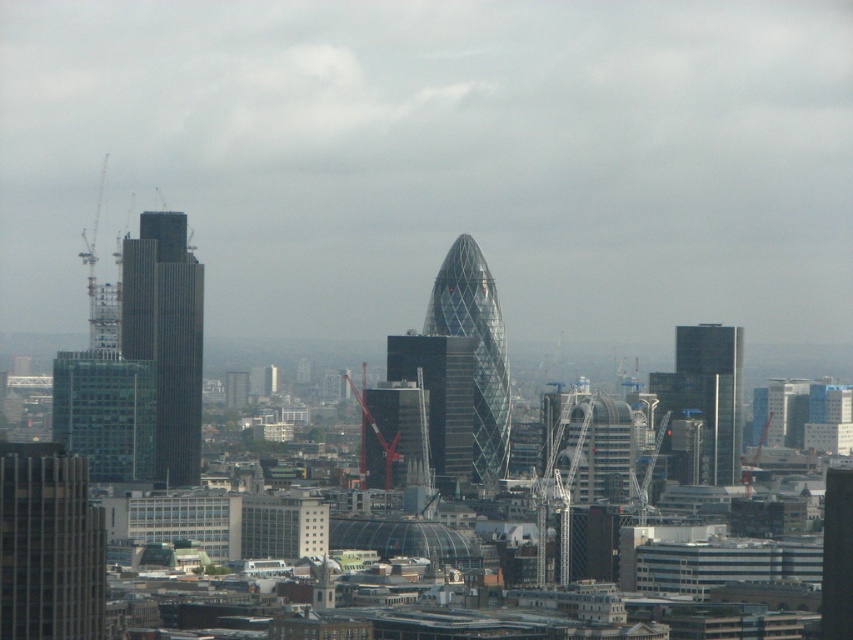
The width and height of the screenshot is (853, 640). What are the coordinates of `dark glass skyscraper at left` in the screenshot? It's located at (166, 337).

Is point (200, 280) behind point (715, 340)?

No, (200, 280) is in front of (715, 340).

Where is `dark glass skyscraper at left`? dark glass skyscraper at left is located at coordinates (166, 337).

Between glassy skyscraper at lower left and dark glass skyscraper at left, which one appears on the left side from the viewer's perspective?

Positioned to the left is glassy skyscraper at lower left.

Is point (28, 458) positioned behind point (170, 221)?

Yes, point (28, 458) is behind point (170, 221).

This screenshot has width=853, height=640. Find the location of `glassy skyscraper at lower left`. glassy skyscraper at lower left is located at coordinates (48, 545).

Does glassy reflective skyscraper at center-right have a lesser width compared to glass skyscraper at center?

No.

Can you confirm if glassy reflective skyscraper at center-right is positioned below glass skyscraper at center?

No, glassy reflective skyscraper at center-right is not below glass skyscraper at center.

Between point (729, 356) and point (380, 476), which one is positioned in front?

Point (380, 476)

Find the location of a particular element. glassy reflective skyscraper at center-right is located at coordinates (712, 392).